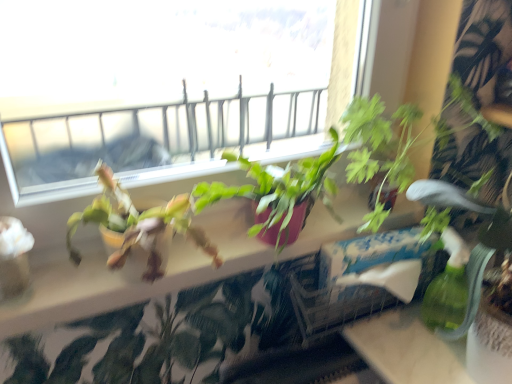
I want to click on free space above white cardboard box at center (from a real-world perspective), so click(362, 258).